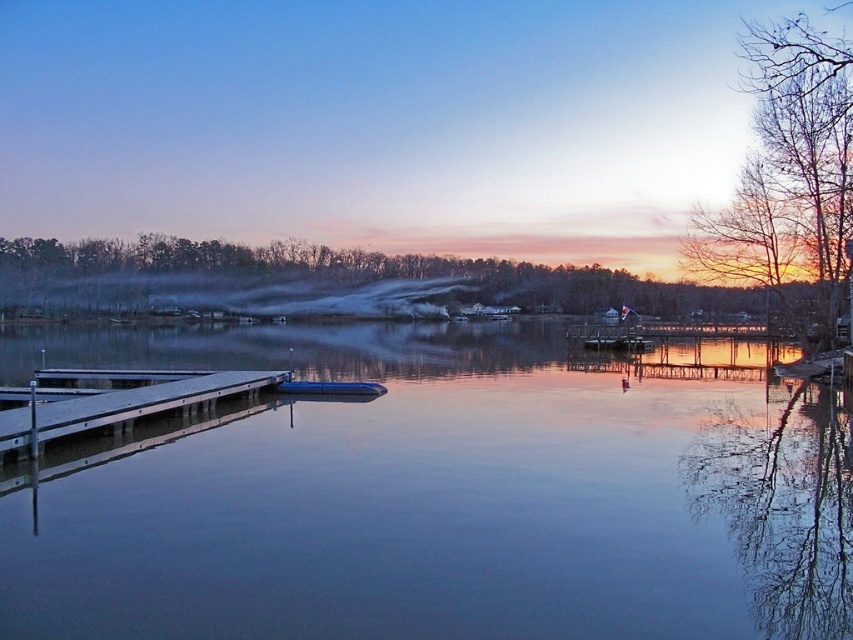
Does brown matte tree at upper center appear over metallic gray dock at lower left?

Yes, brown matte tree at upper center is above metallic gray dock at lower left.

Who is more forward, (494,298) or (62,419)?

Point (62,419) is in front.

Is point (41, 246) behind point (273, 371)?

Yes.

The height and width of the screenshot is (640, 853). I want to click on brown matte tree at upper center, so click(x=404, y=275).

What do you see at coordinates (787, 172) in the screenshot?
I see `bare branches at right` at bounding box center [787, 172].

Who is more distant from viewer, (805, 170) or (144, 289)?

Point (144, 289)

Does point (784, 244) come behind point (86, 275)?

No, it is in front of (86, 275).

What are the coordinates of `bare branches at right` in the screenshot? It's located at (787, 172).

Which of these two, bare branches at right or metallic gray dock at lower left, stands shorter?

metallic gray dock at lower left

Between bare branches at right and metallic gray dock at lower left, which one appears on the right side from the viewer's perspective?

bare branches at right is more to the right.

The width and height of the screenshot is (853, 640). What are the coordinates of `bare branches at right` in the screenshot? It's located at (787, 172).